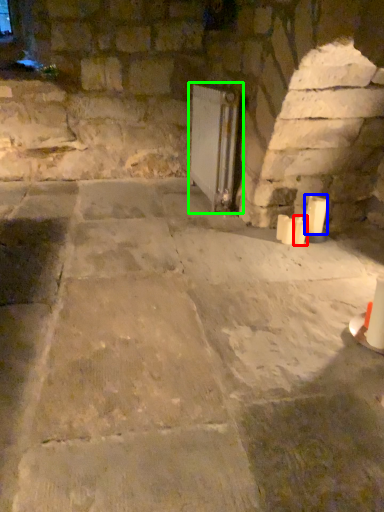
Question: Estimate the real-world distances between objects in this image. Which object is closer to candle (highlighted by a red box), candle (highlighted by a blue box) or fireplace (highlighted by a green box)?

Choices:
 (A) candle
 (B) fireplace

Answer: (A)